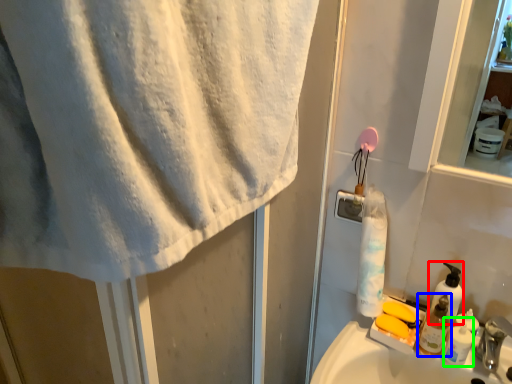
Question: Which object is positioned closest to soap dispenser (highlighted by a red box)? Select from toiletry (highlighted by a blue box) and shaving cream (highlighted by a green box).

Choices:
 (A) toiletry
 (B) shaving cream

Answer: (A)